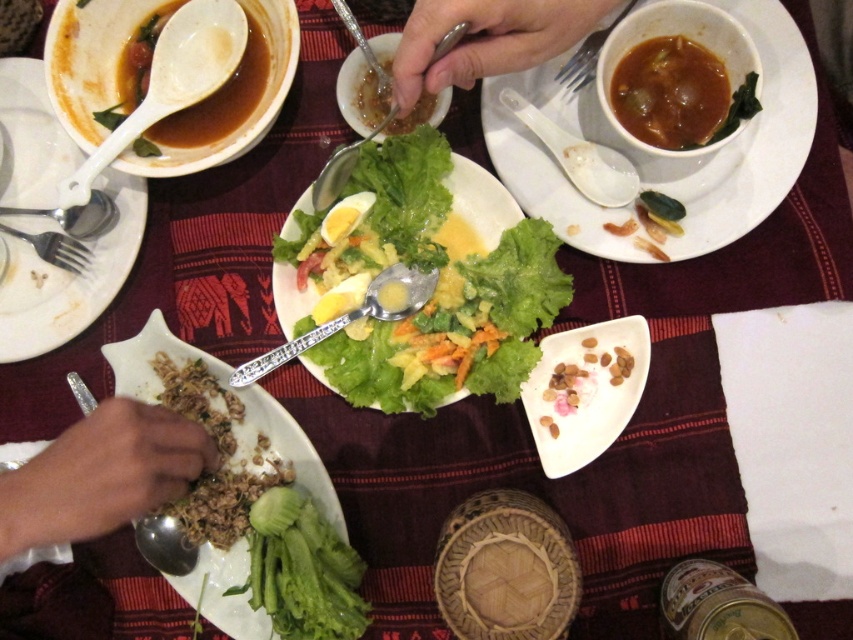
You are a diner who wants to use the white plastic spoon at upper left to eat the brown matte soup at upper left. Is the spoon big enough to scoop the soup?

The white plastic spoon at upper left is larger in size than brown matte soup at upper left, so yes, the spoon is big enough to scoop the soup.